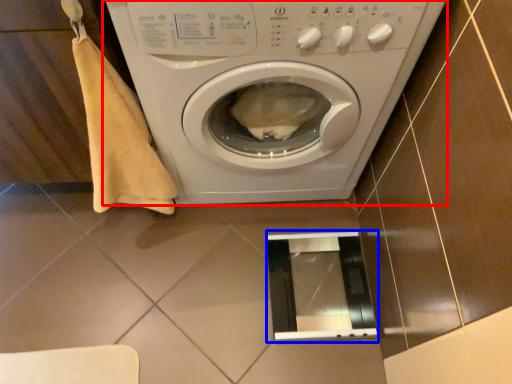
Question: Among these objects, which one is nearest to the camera, washing machine (highlighted by a red box) or screen door (highlighted by a blue box)?

Choices:
 (A) washing machine
 (B) screen door

Answer: (A)